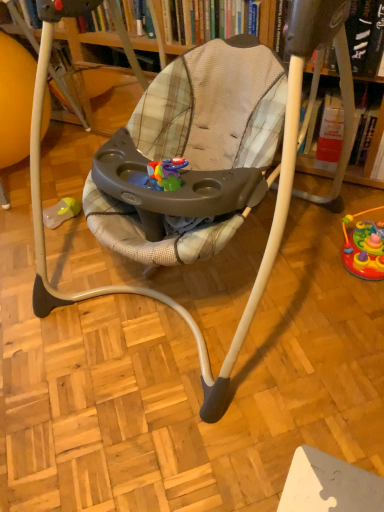
Question: Considering the relative positions of hardcover book at upper center, which is the 1th book from left to right, and hardcover book at upper center, the first book viewed from the right, in the image provided, is hardcover book at upper center, which is the 1th book from left to right, in front of hardcover book at upper center, the first book viewed from the right,?

Choices:
 (A) no
 (B) yes

Answer: (A)

Question: Does hardcover book at upper center, which is the 1th book from left to right, have a greater width compared to hardcover book at upper center, the first book viewed from the right?

Choices:
 (A) yes
 (B) no

Answer: (B)

Question: Does hardcover book at upper center, the 2th book from the right, have a greater height compared to hardcover book at upper center, the first book viewed from the right?

Choices:
 (A) no
 (B) yes

Answer: (A)

Question: Would you say hardcover book at upper center, which is the 1th book from left to right, is outside hardcover book at upper center, the first book viewed from the right?

Choices:
 (A) yes
 (B) no

Answer: (A)

Question: Are hardcover book at upper center, the 2th book from the right, and hardcover book at upper center, the first book viewed from the right, making contact?

Choices:
 (A) yes
 (B) no

Answer: (B)

Question: Based on their sizes in the image, would you say rubberized plastic toy at lower right is bigger or smaller than hardcover book at upper center, the 2th book from the right?

Choices:
 (A) small
 (B) big

Answer: (A)

Question: Considering the positions of point (379, 265) and point (187, 24), is point (379, 265) closer or farther from the camera than point (187, 24)?

Choices:
 (A) closer
 (B) farther

Answer: (A)

Question: Based on their positions, is rubberized plastic toy at lower right located to the left or right of hardcover book at upper center, the 2th book from the right?

Choices:
 (A) left
 (B) right

Answer: (B)

Question: In terms of width, does rubberized plastic toy at lower right look wider or thinner when compared to hardcover book at upper center, the 2th book from the right?

Choices:
 (A) wide
 (B) thin

Answer: (B)

Question: From a real-world perspective, is hardcover book at upper center, which is the 1th book from left to right, positioned above or below plaid fabric baby swing at center?

Choices:
 (A) above
 (B) below

Answer: (A)

Question: Considering the positions of point (236, 10) and point (276, 77), is point (236, 10) closer or farther from the camera than point (276, 77)?

Choices:
 (A) farther
 (B) closer

Answer: (A)

Question: Is hardcover book at upper center, which is the 1th book from left to right, situated inside plaid fabric baby swing at center or outside?

Choices:
 (A) outside
 (B) inside

Answer: (A)

Question: Relative to plaid fabric baby swing at center, is hardcover book at upper center, which is the 1th book from left to right, in front or behind?

Choices:
 (A) front
 (B) behind

Answer: (B)

Question: Is hardcover book at upper center, the 2th book from the right, inside the boundaries of rubberized plastic toy at lower right, or outside?

Choices:
 (A) outside
 (B) inside

Answer: (A)

Question: From a real-world perspective, is hardcover book at upper center, the 2th book from the right, physically located above or below rubberized plastic toy at lower right?

Choices:
 (A) above
 (B) below

Answer: (A)